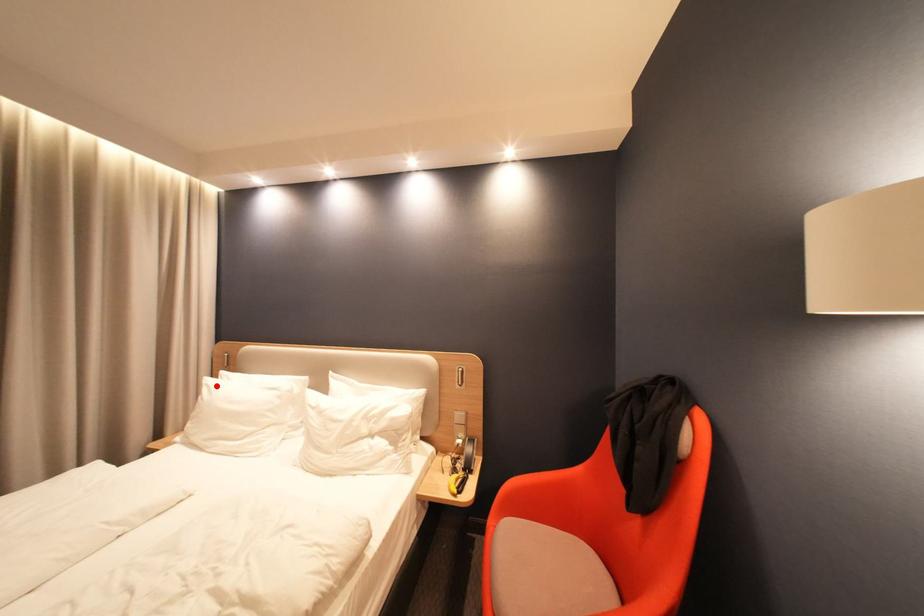
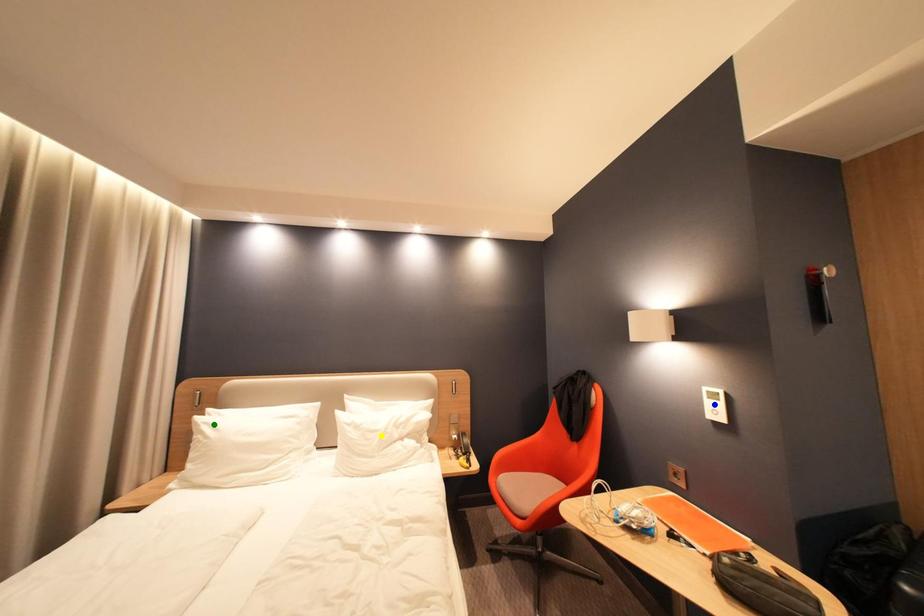
Question: I am providing you with two images of the same scene from different viewpoints. A red point is marked on the first image. You are given multiple points on the second image. Which point in image 2 represents the same 3d spot as the red point in image 1?

Choices:
 (A) green point
 (B) blue point
 (C) yellow point

Answer: (A)